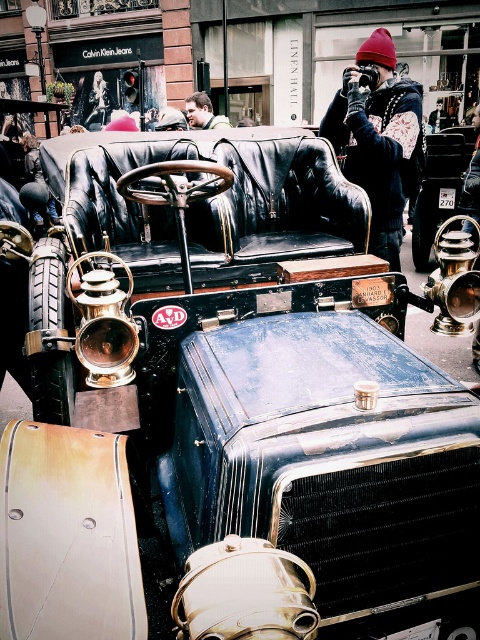
You are a photographer standing in front of the vintage car and want to place a small prop at the exact location where the red knit beanie at upper center is currently positioned. According to the coordinates provided, where should you place the prop?

The red knit beanie at upper center is located at coordinates point (380, 140), so you should place the prop there.

You are a photographer taking a portrait of the vintage car. You notice the red knit beanie at upper center and the smooth skin face at upper center. Which object is closer to the top of the image?

The smooth skin face at upper center is closer to the top of the image because the red knit beanie at upper center is located below it.

You are standing at the base of the vintage car and want to place a red knit beanie at upper center on a shelf that is 12 feet away. Will the beanie fit on the shelf?

The red knit beanie at upper center is 13.52 feet away from you, so it is too far to place on the 12 feet away shelf. You need to move closer or choose a nearer shelf.